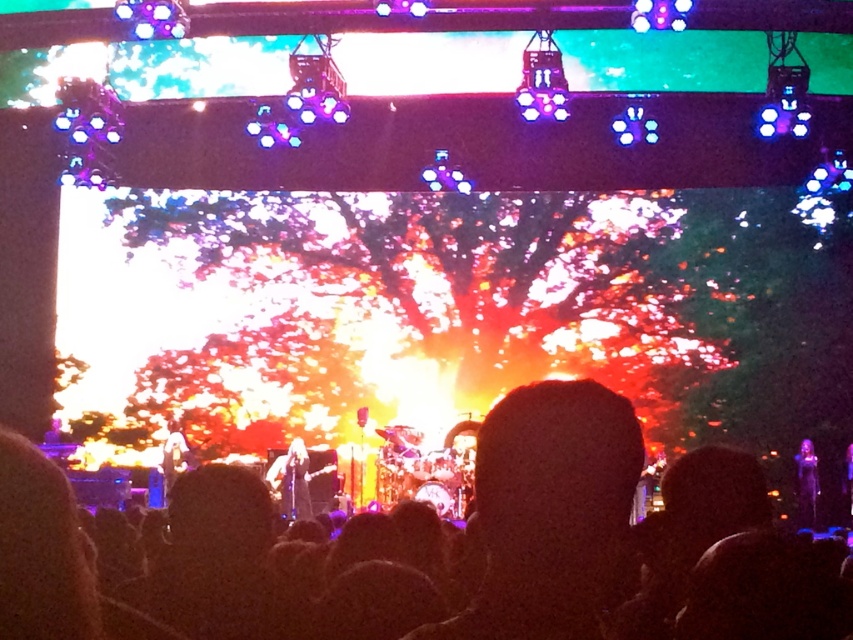
Question: From the image, what is the correct spatial relationship of silhouette crowd at center in relation to shiny black guitar at center?

Choices:
 (A) right
 (B) left

Answer: (A)

Question: Can you confirm if silhouette crowd at center is positioned to the left of shiny black guitar at center?

Choices:
 (A) no
 (B) yes

Answer: (A)

Question: Based on their relative distances, which object is nearer to the shiny black dress at lower right?

Choices:
 (A) silhouette crowd at center
 (B) shiny black guitar at center

Answer: (B)

Question: Considering the real-world distances, which object is farthest from the shiny black dress at lower right?

Choices:
 (A) silhouette crowd at center
 (B) shiny black guitar at center
 (C) shiny silver guitar at center

Answer: (A)

Question: Does silhouette crowd at center have a smaller size compared to shiny black guitar at center?

Choices:
 (A) no
 (B) yes

Answer: (A)

Question: Which point is farther to the camera?

Choices:
 (A) (283, 476)
 (B) (682, 488)
 (C) (173, 476)

Answer: (C)